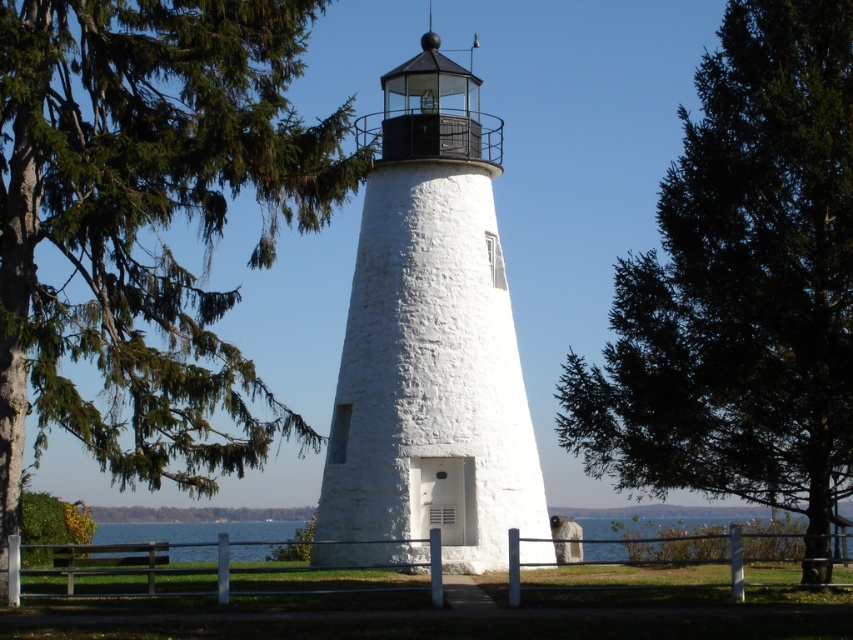
Question: Among these points, which one is farthest from the camera?

Choices:
 (A) (608, 524)
 (B) (24, 124)

Answer: (A)

Question: From the image, what is the correct spatial relationship of green leafy tree at upper left in relation to white stucco lighthouse at center?

Choices:
 (A) right
 (B) left

Answer: (B)

Question: Considering the real-world distances, which object is farthest from the green leafy tree at upper left?

Choices:
 (A) transparent water at lower center
 (B) green leafy tree at center
 (C) white stucco lighthouse at center

Answer: (A)

Question: Where is white stucco lighthouse at center located in relation to blue water at lower center in the image?

Choices:
 (A) below
 (B) above

Answer: (B)

Question: Which of the following is the farthest from the observer?

Choices:
 (A) (277, 186)
 (B) (817, 108)
 (C) (233, 525)
 (D) (209, 550)

Answer: (C)

Question: Can you confirm if green leafy tree at center is thinner than white stucco lighthouse at center?

Choices:
 (A) yes
 (B) no

Answer: (B)